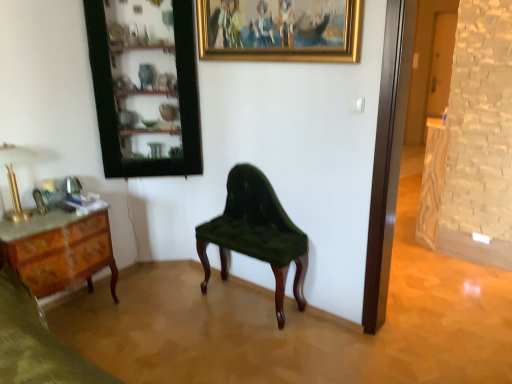
You are a GUI agent. You are given a task and a screenshot of the screen. Output one action in this format:
    pyautogui.click(x=<x>, y=<y>)
    Task: Click on the free point below wooden cabinet at upper left (from a real-world perspective)
    The height and width of the screenshot is (384, 512).
    Given the screenshot: What is the action you would take?
    pyautogui.click(x=161, y=269)